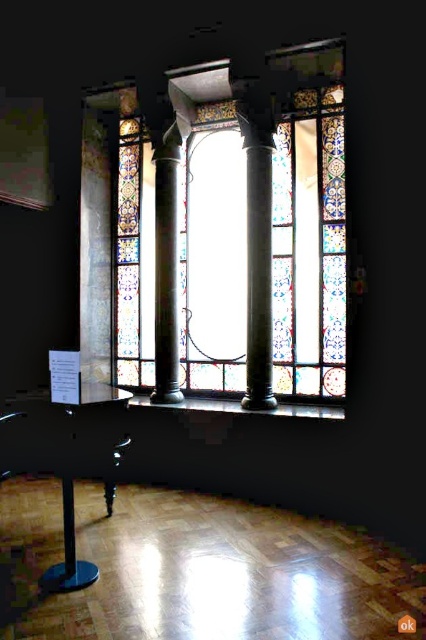
Question: Can you confirm if polished dark green column at center is smaller than black plastic stool at lower left?

Choices:
 (A) yes
 (B) no

Answer: (A)

Question: Which is farther from the polished marble column at center?

Choices:
 (A) polished dark green column at center
 (B) black plastic stool at lower left

Answer: (B)

Question: Does polished marble column at center appear on the right side of polished dark green column at center?

Choices:
 (A) yes
 (B) no

Answer: (A)

Question: Which point is farther from the camera taking this photo?

Choices:
 (A) (117, 451)
 (B) (241, 120)
 (C) (158, 340)

Answer: (C)

Question: Which point is closer to the camera?

Choices:
 (A) black plastic stool at lower left
 (B) polished dark green column at center
 (C) polished marble column at center

Answer: (A)

Question: Does polished marble column at center come in front of polished dark green column at center?

Choices:
 (A) no
 (B) yes

Answer: (B)